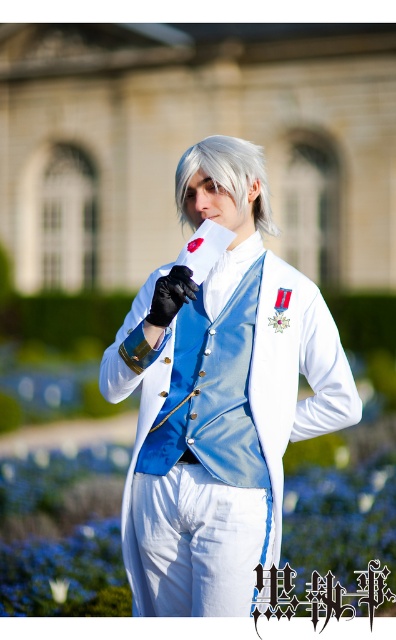
Looking at this image, you are a photographer trying to capture the person in the scene. You notice the white glossy vest at center and the slick silver hair at center. Which object should you focus on to ensure the other is still visible in the frame?

The white glossy vest at center is in front of the slick silver hair at center, so focusing on the white glossy vest at center will keep both objects in view since it is closer to the camera.

You are a photographer trying to capture the scene with the two points marked in the image. Which point, point (298,321) or point (266,180), is closer to the camera?

Point (298,321) is closer to the camera as it is in front of point (266,180).